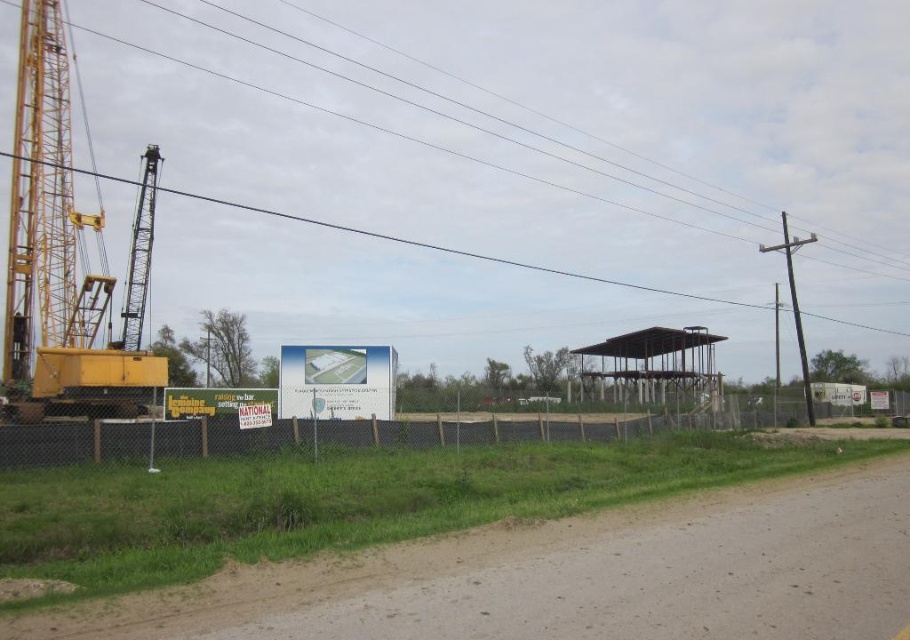
Question: From the image, what is the correct spatial relationship of brown gravel road at lower right in relation to smooth gray pole at right?

Choices:
 (A) right
 (B) left

Answer: (B)

Question: Which of the following is the closest to the observer?

Choices:
 (A) smooth gray pole at right
 (B) yellow metallic crane at left

Answer: (B)

Question: Observing the image, what is the correct spatial positioning of metallic wire at upper center in reference to smooth gray pole at right?

Choices:
 (A) below
 (B) above

Answer: (B)

Question: Is yellow metallic crane at left to the right of metallic wire at upper center from the viewer's perspective?

Choices:
 (A) yes
 (B) no

Answer: (B)

Question: Which point is closer to the camera?

Choices:
 (A) [44, 451]
 (B) [305, 378]
 (C) [781, 244]

Answer: (A)

Question: Which point is closer to the camera?

Choices:
 (A) yellow metallic crane at left
 (B) black chain-link fence at center
 (C) smooth gray pole at right
 (D) white plastic sign at center

Answer: (B)